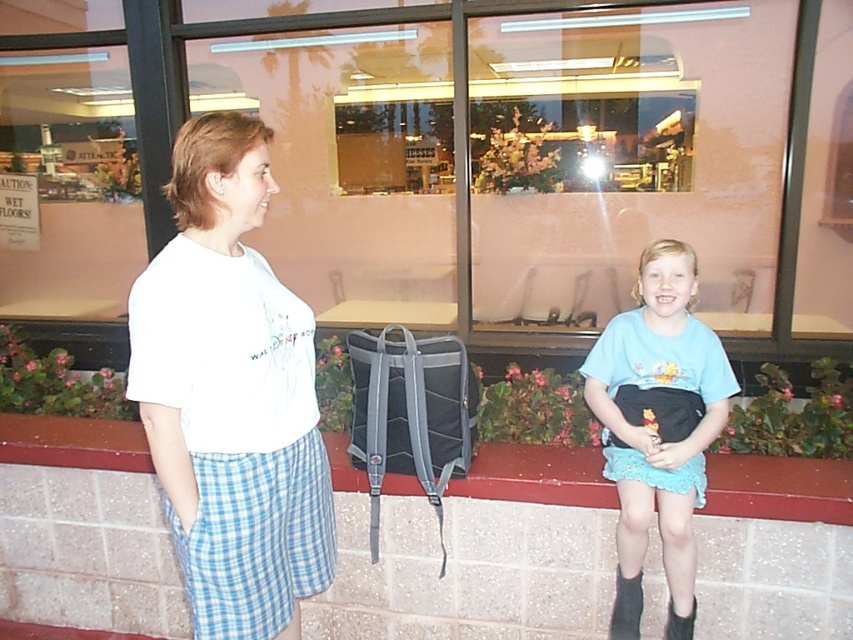
You are standing in front of the building and want to locate the light blue fabric skirt at lower right. According to the coordinates provided, where should you look?

You should look at point (659, 412) to find the light blue fabric skirt at lower right.